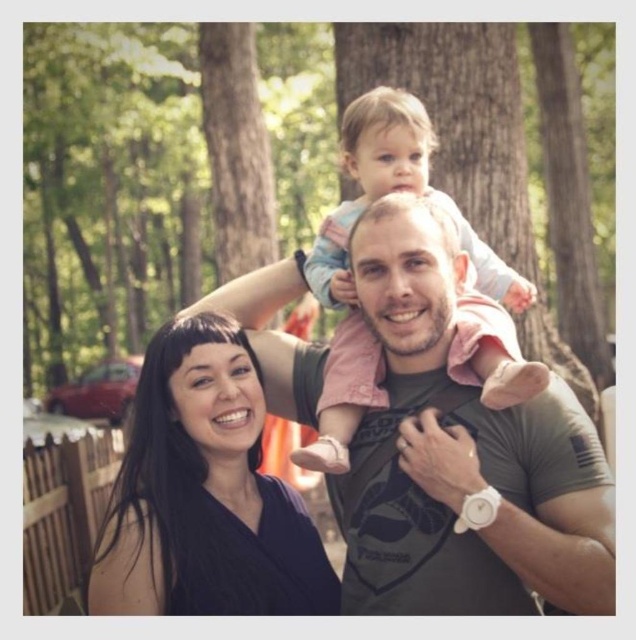
Question: Based on their relative distances, which object is nearer to the matte gray shirt at center?

Choices:
 (A) black matte hair at center
 (B) light pink fabric at center

Answer: (B)

Question: Can you confirm if matte gray shirt at center is positioned to the right of light pink fabric at center?

Choices:
 (A) yes
 (B) no

Answer: (B)

Question: In this image, where is matte gray shirt at center located relative to light pink fabric at center?

Choices:
 (A) above
 (B) below

Answer: (B)

Question: Which of the following is the closest to the observer?

Choices:
 (A) black matte hair at center
 (B) light pink fabric at center

Answer: (B)

Question: Which object is farther from the camera taking this photo?

Choices:
 (A) light pink fabric at center
 (B) matte gray shirt at center

Answer: (B)

Question: Is matte gray shirt at center wider than light pink fabric at center?

Choices:
 (A) yes
 (B) no

Answer: (B)